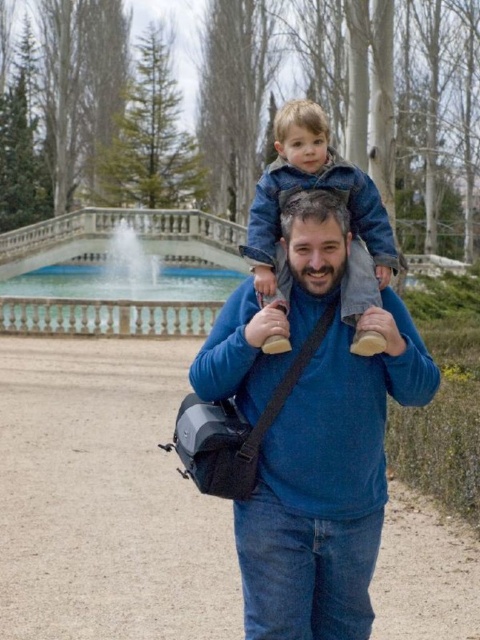
Question: Which is nearer to the blue cotton sweater at center?

Choices:
 (A) blue denim jacket at upper center
 (B) white marble fountain at center

Answer: (A)

Question: Which object is closer to the camera taking this photo?

Choices:
 (A) blue cotton sweater at center
 (B) blue denim jacket at upper center

Answer: (A)

Question: Which point is farther to the camera?

Choices:
 (A) pos(358,280)
 (B) pos(212,248)
 (C) pos(324,372)

Answer: (B)

Question: In this image, where is blue cotton sweater at center located relative to white marble fountain at center?

Choices:
 (A) below
 (B) above

Answer: (A)

Question: Can you confirm if blue cotton sweater at center is positioned below white marble fountain at center?

Choices:
 (A) yes
 (B) no

Answer: (A)

Question: From the image, what is the correct spatial relationship of white marble fountain at center in relation to blue denim jacket at upper center?

Choices:
 (A) above
 (B) below

Answer: (A)